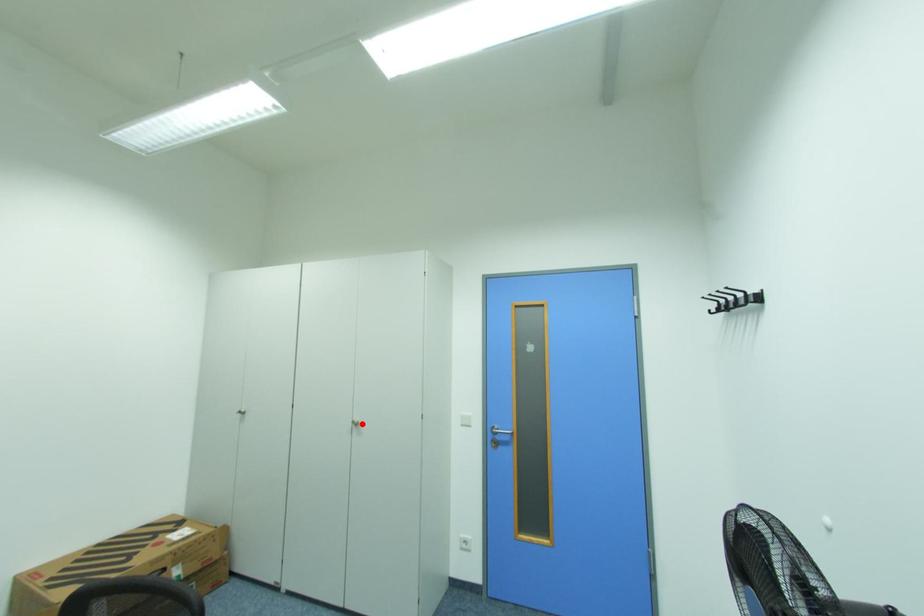
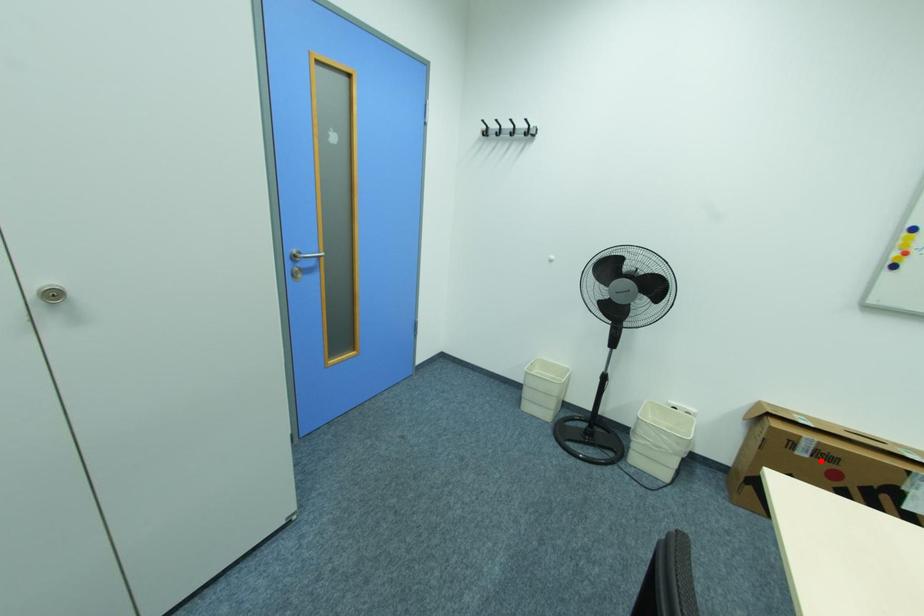
I am providing you with two images of the same scene from different viewpoints. A red point is marked on the first image and another point is marked on the second image. Is the red point in image1 aligned with the point shown in image2?

No